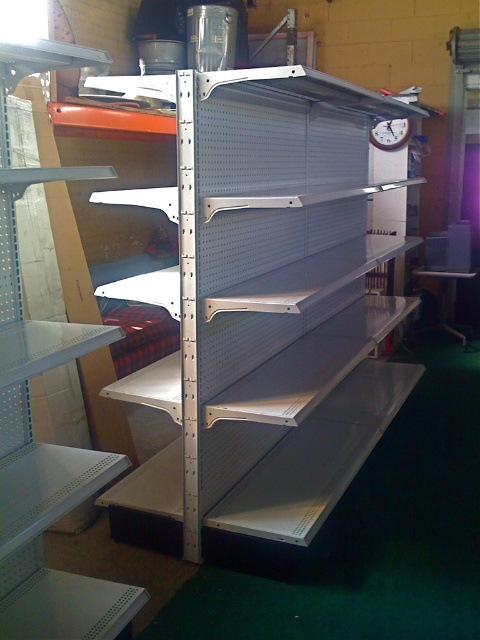
Question: Estimate the real-world distances between objects in this image. Which object is closer to the metallic silver shelves at center?

Choices:
 (A) white plastic clock at upper center
 (B) metallic silver workbench at lower right
 (C) metallic gray shelves at center

Answer: (C)

Question: Is metallic gray shelves at center wider than metallic silver shelves at center?

Choices:
 (A) no
 (B) yes

Answer: (B)

Question: Is metallic silver shelves at center wider than white plastic clock at upper center?

Choices:
 (A) yes
 (B) no

Answer: (A)

Question: Which object is the farthest from the white plastic clock at upper center?

Choices:
 (A) metallic gray shelves at center
 (B) metallic silver workbench at lower right

Answer: (A)

Question: Which object is positioned closest to the metallic gray shelves at center?

Choices:
 (A) metallic silver workbench at lower right
 (B) white plastic clock at upper center

Answer: (B)

Question: Can you confirm if metallic gray shelves at center is thinner than metallic silver workbench at lower right?

Choices:
 (A) no
 (B) yes

Answer: (A)